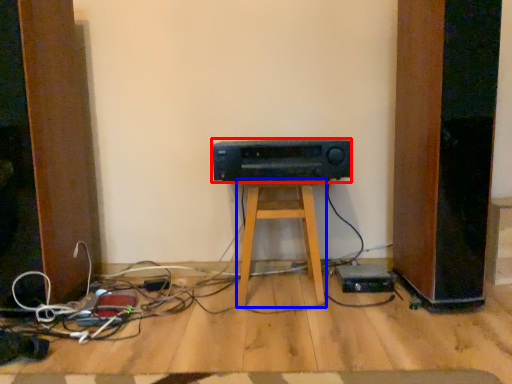
Question: Which object is closer to the camera taking this photo, amplifier (highlighted by a red box) or furniture (highlighted by a blue box)?

Choices:
 (A) amplifier
 (B) furniture

Answer: (A)